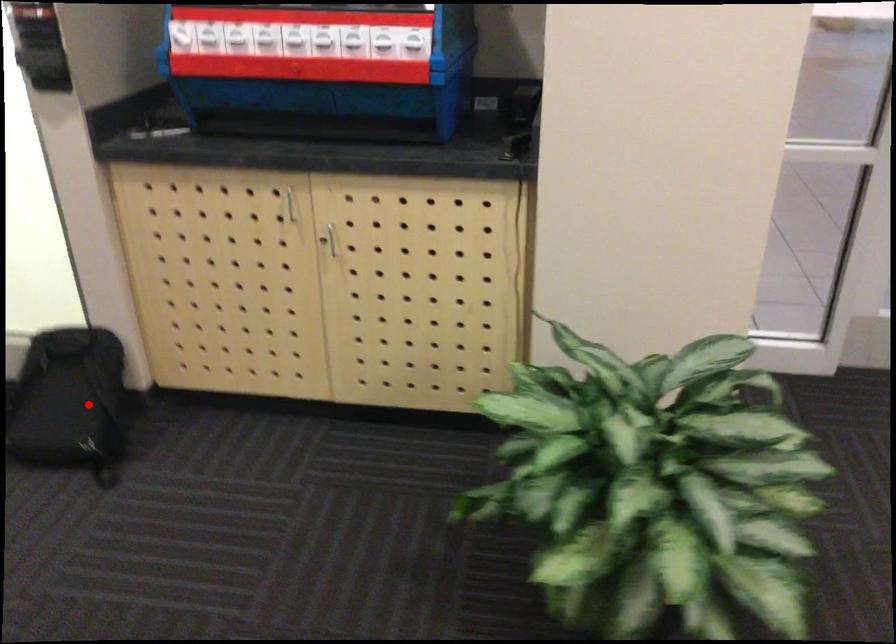
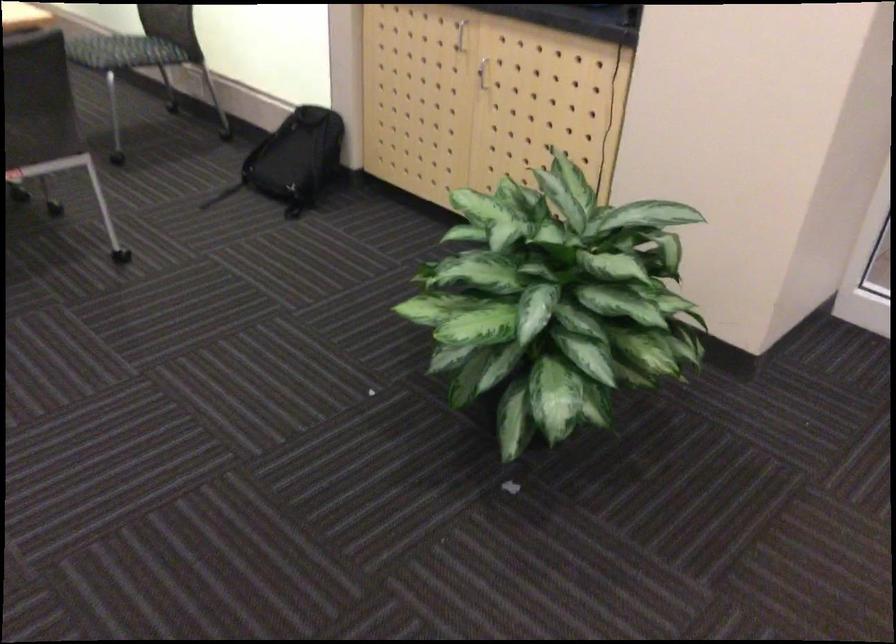
Find the pixel in the second image that matches the highlighted location in the first image.

(293, 160)